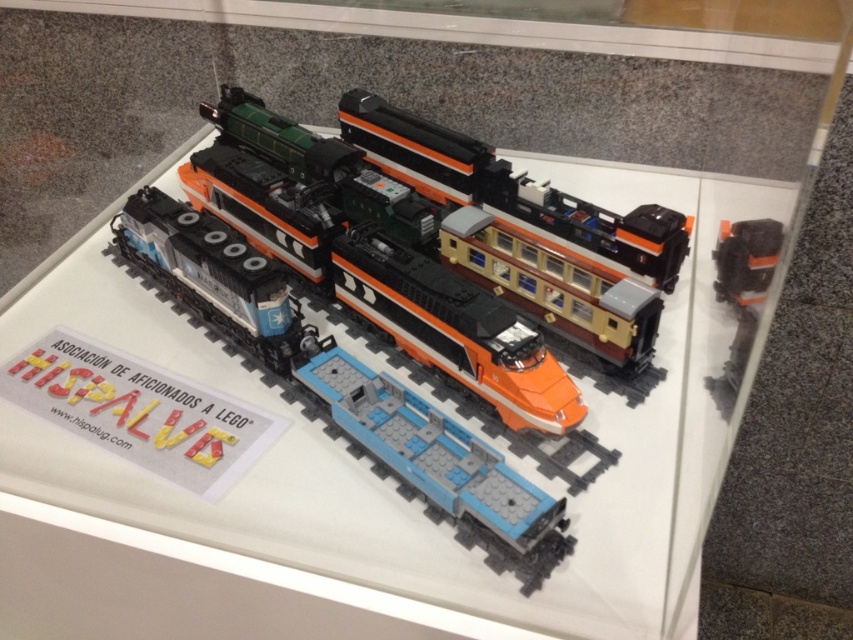
What do you see at coordinates (389, 289) in the screenshot? The height and width of the screenshot is (640, 853). I see `orange matte train at center` at bounding box center [389, 289].

From the picture: Between orange matte train at center and orange matte train car at upper right, which one is positioned lower?

orange matte train car at upper right is below.

Between point (553, 401) and point (730, 246), which one is positioned behind?

The point (730, 246) is behind.

Find the location of `orange matte train at center`. orange matte train at center is located at coordinates (389, 289).

Between point (212, 172) and point (380, 150), which one is positioned behind?

Positioned behind is point (380, 150).

Can you confirm if orange matte train at center is bigger than orange matte train car at center?

Indeed, orange matte train at center has a larger size compared to orange matte train car at center.

Identify the location of orange matte train at center. This screenshot has width=853, height=640. click(x=389, y=289).

Between orange matte train car at center and orange matte train car at upper right, which one is positioned lower?

orange matte train car at upper right is below.

Does orange matte train car at center appear under orange matte train car at upper right?

Actually, orange matte train car at center is above orange matte train car at upper right.

Who is more forward, (660,284) or (723,248)?

Positioned in front is point (660,284).

This screenshot has height=640, width=853. Find the location of `orange matte train car at center`. orange matte train car at center is located at coordinates (515, 195).